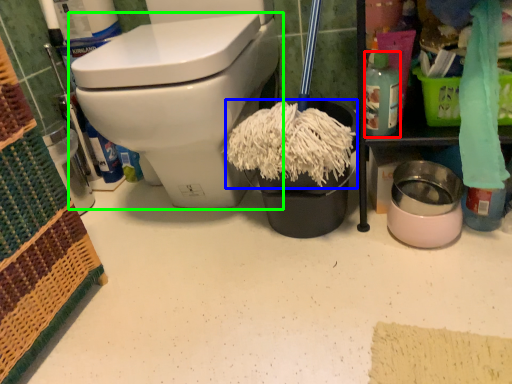
Question: Based on their relative distances, which object is nearer to cleaning product (highlighted by a red box)? Choose from debris (highlighted by a blue box) and toilet (highlighted by a green box).

Choices:
 (A) debris
 (B) toilet

Answer: (A)